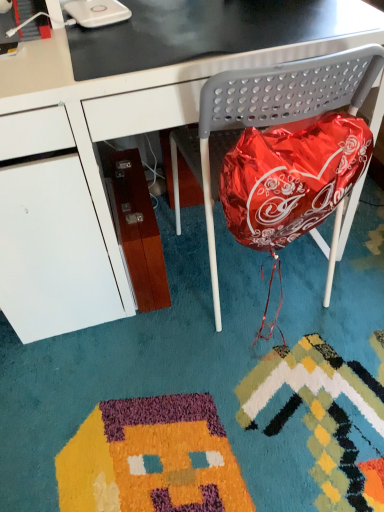
Where is `vacant space that is in between black glossy desk at center and metallic gray folding chair at center`? The width and height of the screenshot is (384, 512). vacant space that is in between black glossy desk at center and metallic gray folding chair at center is located at coordinates (173, 323).